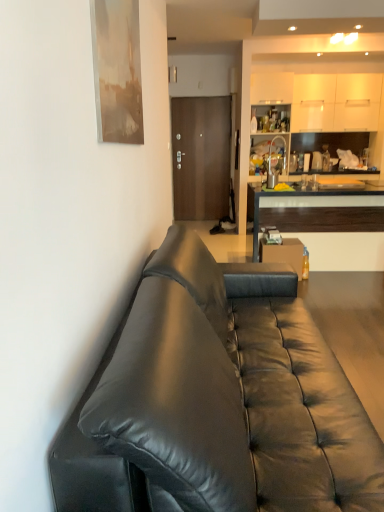
Question: Is wooden cabinet at right bigger than black leather couch at left?

Choices:
 (A) yes
 (B) no

Answer: (B)

Question: Is wooden cabinet at right thinner than black leather couch at left?

Choices:
 (A) no
 (B) yes

Answer: (B)

Question: Considering the relative sizes of wooden cabinet at right and black leather couch at left in the image provided, is wooden cabinet at right shorter than black leather couch at left?

Choices:
 (A) no
 (B) yes

Answer: (B)

Question: From the image's perspective, would you say wooden cabinet at right is positioned over black leather couch at left?

Choices:
 (A) yes
 (B) no

Answer: (A)

Question: Considering the relative sizes of wooden cabinet at right and black leather couch at left in the image provided, is wooden cabinet at right wider than black leather couch at left?

Choices:
 (A) no
 (B) yes

Answer: (A)

Question: Would you say wooden cabinet at right is outside black leather couch at left?

Choices:
 (A) no
 (B) yes

Answer: (B)

Question: Can you confirm if black leather couch at left is shorter than wooden cabinet at right?

Choices:
 (A) yes
 (B) no

Answer: (B)

Question: Considering the relative sizes of black leather couch at left and wooden cabinet at right in the image provided, is black leather couch at left bigger than wooden cabinet at right?

Choices:
 (A) no
 (B) yes

Answer: (B)

Question: From the image's perspective, is black leather couch at left on wooden cabinet at right?

Choices:
 (A) no
 (B) yes

Answer: (A)

Question: From a real-world perspective, is black leather couch at left positioned under wooden cabinet at right based on gravity?

Choices:
 (A) yes
 (B) no

Answer: (B)

Question: Would you say black leather couch at left is outside wooden cabinet at right?

Choices:
 (A) yes
 (B) no

Answer: (A)

Question: Is black leather couch at left further to camera compared to wooden cabinet at right?

Choices:
 (A) no
 (B) yes

Answer: (A)

Question: Can you confirm if black leather couch at left is positioned to the right of brown matte door at center?

Choices:
 (A) yes
 (B) no

Answer: (A)